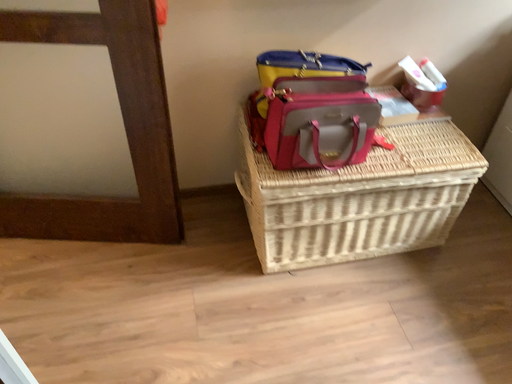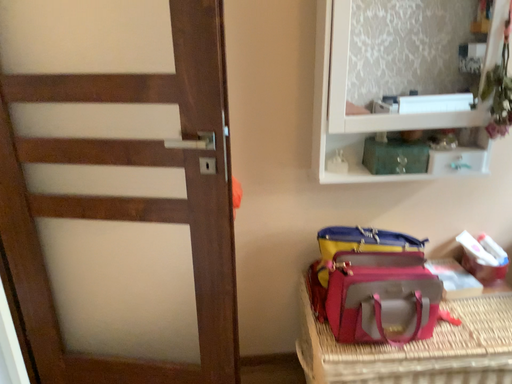
Question: How did the camera likely rotate when shooting the video?

Choices:
 (A) rotated upward
 (B) rotated downward

Answer: (A)